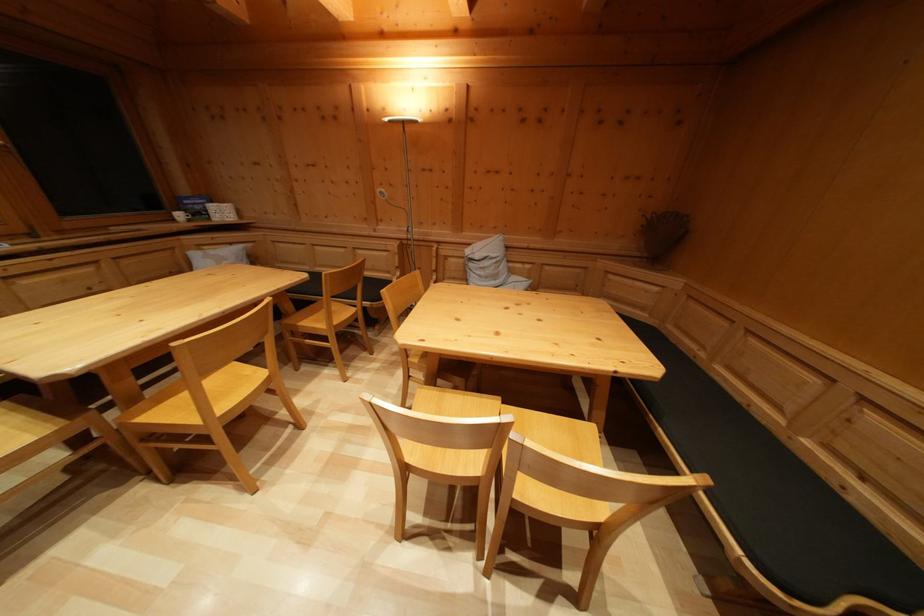
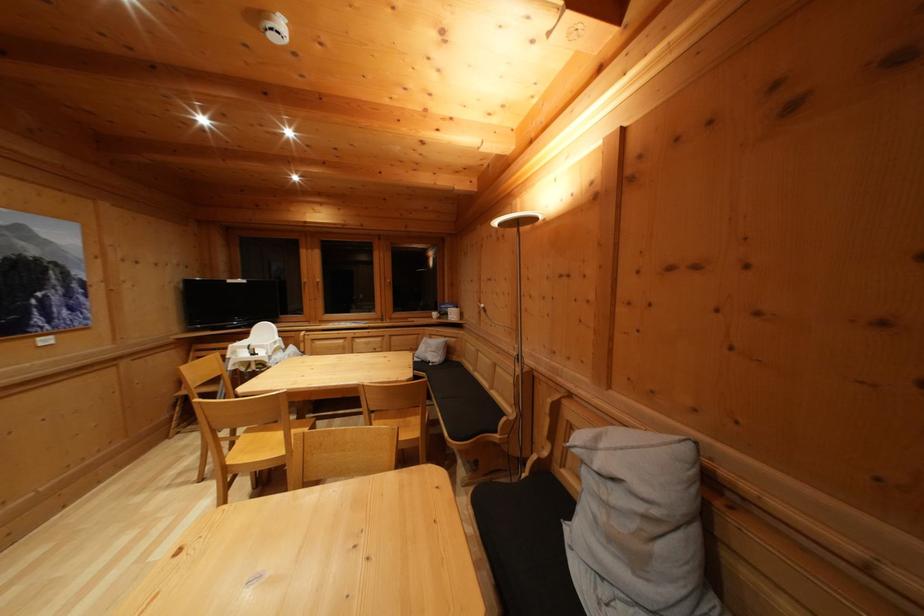
Where in the second image is the point corresponding to pixel 501 284 from the first image?

(640, 565)